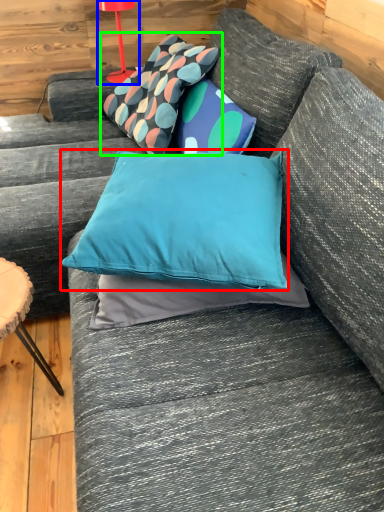
Question: Considering the real-world distances, which object is closest to pillow (highlighted by a red box)? table lamp (highlighted by a blue box) or pillow (highlighted by a green box).

Choices:
 (A) table lamp
 (B) pillow

Answer: (B)